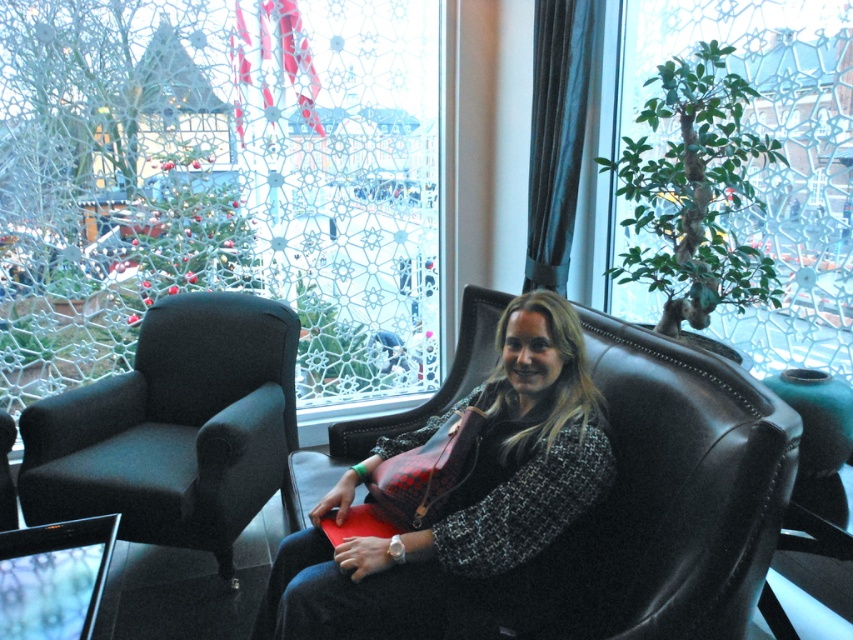
Question: Which of these objects is positioned farthest from the green leafy plant at upper right?

Choices:
 (A) matte black purse at center
 (B) transparent glass window at center

Answer: (B)

Question: Is the position of dark gray fabric swivel chair at left less distant than that of green leafy plant at upper right?

Choices:
 (A) no
 (B) yes

Answer: (A)

Question: Which of these objects is positioned farthest from the green leafy plant at upper right?

Choices:
 (A) matte black purse at center
 (B) dark gray fabric swivel chair at left

Answer: (B)

Question: Which is farther from the matte black purse at center?

Choices:
 (A) dark gray fabric swivel chair at left
 (B) green leafy plant at upper right

Answer: (B)

Question: Is the position of transparent glass window at center more distant than that of matte black purse at center?

Choices:
 (A) no
 (B) yes

Answer: (B)

Question: Is the position of transparent glass window at center more distant than that of green leafy plant at upper right?

Choices:
 (A) no
 (B) yes

Answer: (B)